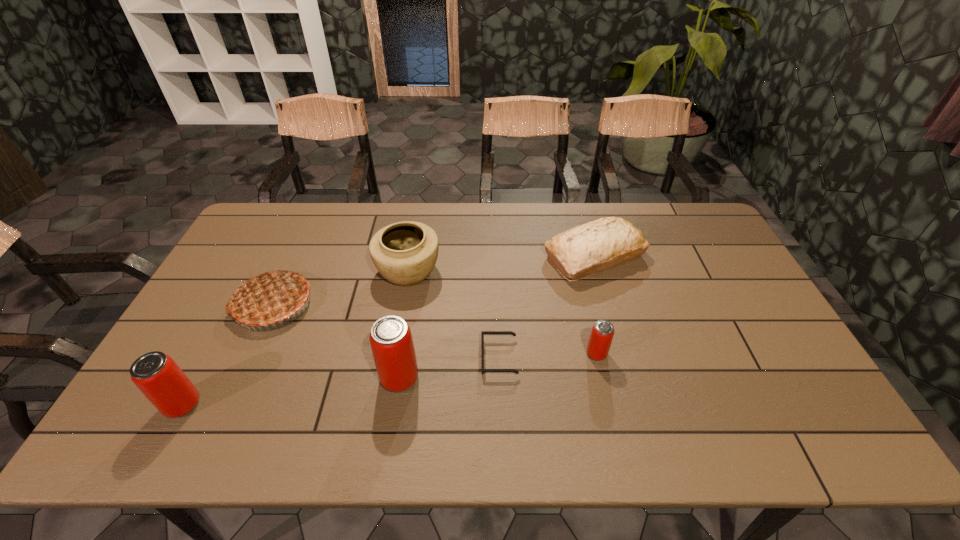
Find the location of a particular element. The height and width of the screenshot is (540, 960). vacant area situated 0.170m on the back of the rightmost beer can is located at coordinates (584, 299).

The image size is (960, 540). I want to click on free location located 0.210m on the left of the bread, so click(479, 256).

Locate an element on the screen. blank space located 0.400m on the front-facing side of the fifth object from left to right is located at coordinates (329, 357).

Image resolution: width=960 pixels, height=540 pixels. I want to click on free spot located on the front-facing side of the fifth object from left to right, so [x=428, y=357].

Identify the location of free space located 0.080m on the front-facing side of the fifth object from left to right. This screenshot has width=960, height=540. (451, 357).

At what (x,y) coordinates should I click in order to perform the action: click on vacant position located 0.120m on the front of the pottery. Please return your answer as a coordinate pair (x, y). The height and width of the screenshot is (540, 960). Looking at the image, I should click on (398, 325).

The image size is (960, 540). Find the location of `vacant space situated on the back of the pie`. vacant space situated on the back of the pie is located at coordinates (311, 222).

At what (x,y) coordinates should I click in order to perform the action: click on object located at the far edge. Please return your answer as a coordinate pair (x, y). Looking at the image, I should click on (582, 251).

Identify the location of sunglasses that is at the near edge. (483, 333).

The height and width of the screenshot is (540, 960). Identify the location of beer can that is at the left edge. (157, 376).